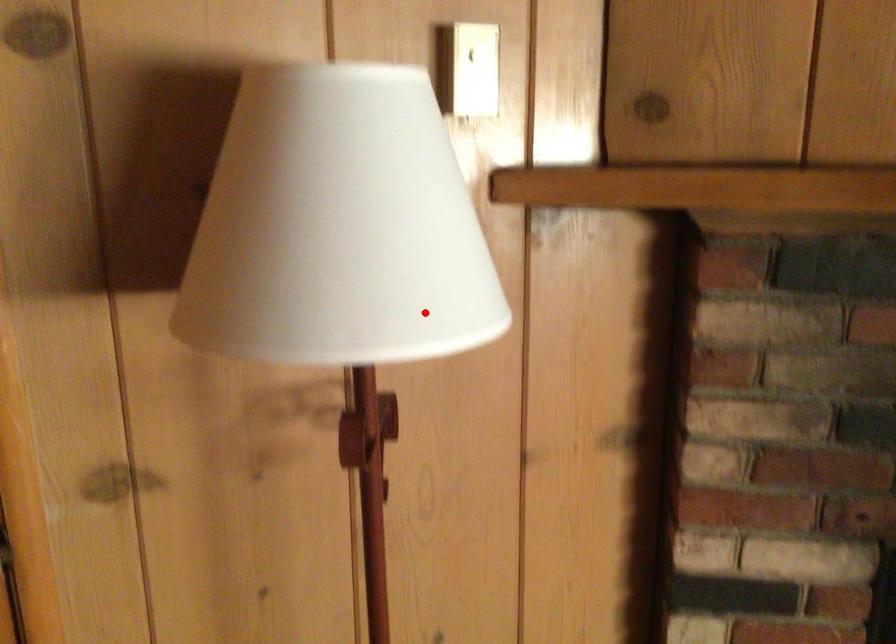
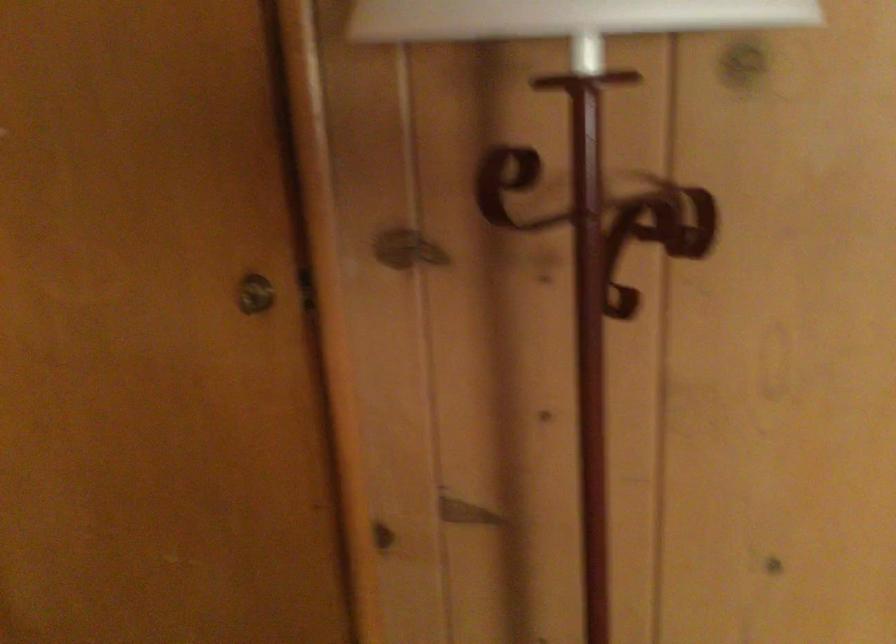
Question: I am providing you with two images of the same scene from different viewpoints. In image1, a red point is highlighted. Considering the same 3D point in image2, which of the following is correct?

Choices:
 (A) It is closer
 (B) It is farther

Answer: (A)